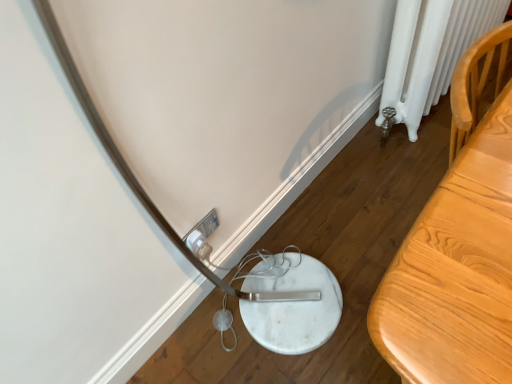
Question: Can you confirm if white plastic electric outlet at lower center is smaller than light wood table at right?

Choices:
 (A) yes
 (B) no

Answer: (A)

Question: Considering the relative sizes of white plastic electric outlet at lower center and light wood table at right in the image provided, is white plastic electric outlet at lower center thinner than light wood table at right?

Choices:
 (A) yes
 (B) no

Answer: (A)

Question: Is white plastic electric outlet at lower center shorter than light wood table at right?

Choices:
 (A) no
 (B) yes

Answer: (B)

Question: From a real-world perspective, does white plastic electric outlet at lower center stand above light wood table at right?

Choices:
 (A) no
 (B) yes

Answer: (A)

Question: Would you say white plastic electric outlet at lower center contains light wood table at right?

Choices:
 (A) yes
 (B) no

Answer: (B)

Question: In terms of height, does white painted radiator at right look taller or shorter compared to white plastic electric outlet at lower center?

Choices:
 (A) short
 (B) tall

Answer: (B)

Question: Relative to white plastic electric outlet at lower center, is white painted radiator at right in front or behind?

Choices:
 (A) behind
 (B) front

Answer: (A)

Question: From the image's perspective, is white painted radiator at right located above or below white plastic electric outlet at lower center?

Choices:
 (A) above
 (B) below

Answer: (A)

Question: Visually, is white painted radiator at right positioned to the left or to the right of white plastic electric outlet at lower center?

Choices:
 (A) right
 (B) left

Answer: (A)

Question: Is white plastic electric outlet at lower center wider or thinner than white painted radiator at right?

Choices:
 (A) thin
 (B) wide

Answer: (A)

Question: Would you say white plastic electric outlet at lower center is inside or outside white painted radiator at right?

Choices:
 (A) inside
 (B) outside

Answer: (B)

Question: Considering the positions of white plastic electric outlet at lower center and white painted radiator at right in the image, is white plastic electric outlet at lower center bigger or smaller than white painted radiator at right?

Choices:
 (A) small
 (B) big

Answer: (A)

Question: Is point (201, 238) positioned closer to the camera than point (412, 86)?

Choices:
 (A) farther
 (B) closer

Answer: (B)

Question: From their relative heights in the image, would you say light wood table at right is taller or shorter than white plastic electric outlet at lower center?

Choices:
 (A) tall
 (B) short

Answer: (A)

Question: Based on their sizes in the image, would you say light wood table at right is bigger or smaller than white plastic electric outlet at lower center?

Choices:
 (A) small
 (B) big

Answer: (B)